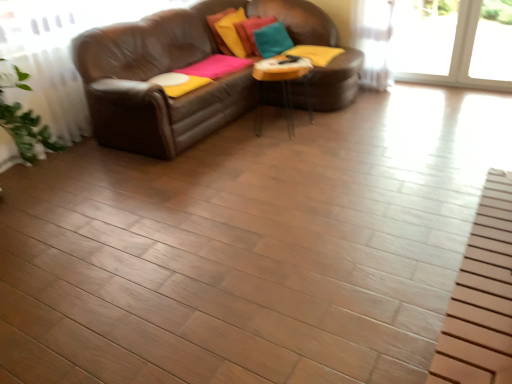
Question: Does clear glass table at center have a larger size compared to velvet yellow pillow at upper center, marked as the 1th pillow in a left-to-right arrangement?

Choices:
 (A) yes
 (B) no

Answer: (A)

Question: Is clear glass table at center facing towards velvet yellow pillow at upper center, placed as the third pillow when sorted from right to left?

Choices:
 (A) no
 (B) yes

Answer: (A)

Question: Is clear glass table at center far from velvet yellow pillow at upper center, placed as the third pillow when sorted from right to left?

Choices:
 (A) yes
 (B) no

Answer: (B)

Question: Is clear glass table at center outside velvet yellow pillow at upper center, placed as the third pillow when sorted from right to left?

Choices:
 (A) no
 (B) yes

Answer: (B)

Question: Does clear glass table at center appear on the left side of velvet yellow pillow at upper center, marked as the 1th pillow in a left-to-right arrangement?

Choices:
 (A) yes
 (B) no

Answer: (B)

Question: Considering the relative sizes of clear glass table at center and velvet yellow pillow at upper center, placed as the third pillow when sorted from right to left, in the image provided, is clear glass table at center smaller than velvet yellow pillow at upper center, placed as the third pillow when sorted from right to left,?

Choices:
 (A) no
 (B) yes

Answer: (A)

Question: From a real-world perspective, is velvet yellow pillow at upper center, marked as the 1th pillow in a left-to-right arrangement, beneath clear glass table at center?

Choices:
 (A) no
 (B) yes

Answer: (A)

Question: Is velvet yellow pillow at upper center, marked as the 1th pillow in a left-to-right arrangement, at the right side of clear glass table at center?

Choices:
 (A) yes
 (B) no

Answer: (B)

Question: Considering the relative sizes of velvet yellow pillow at upper center, marked as the 1th pillow in a left-to-right arrangement, and clear glass table at center in the image provided, is velvet yellow pillow at upper center, marked as the 1th pillow in a left-to-right arrangement, smaller than clear glass table at center?

Choices:
 (A) no
 (B) yes

Answer: (B)

Question: From a real-world perspective, is velvet yellow pillow at upper center, marked as the 1th pillow in a left-to-right arrangement, positioned over clear glass table at center based on gravity?

Choices:
 (A) yes
 (B) no

Answer: (A)

Question: Is velvet yellow pillow at upper center, marked as the 1th pillow in a left-to-right arrangement, positioned before clear glass table at center?

Choices:
 (A) no
 (B) yes

Answer: (A)

Question: Is velvet yellow pillow at upper center, marked as the 1th pillow in a left-to-right arrangement, not near clear glass table at center?

Choices:
 (A) yes
 (B) no

Answer: (B)

Question: Does velvet teal pillow at upper center, the 2th pillow in the left-to-right sequence, lie in front of teal fabric pillow at upper center, the 3th pillow when ordered from left to right?

Choices:
 (A) no
 (B) yes

Answer: (A)